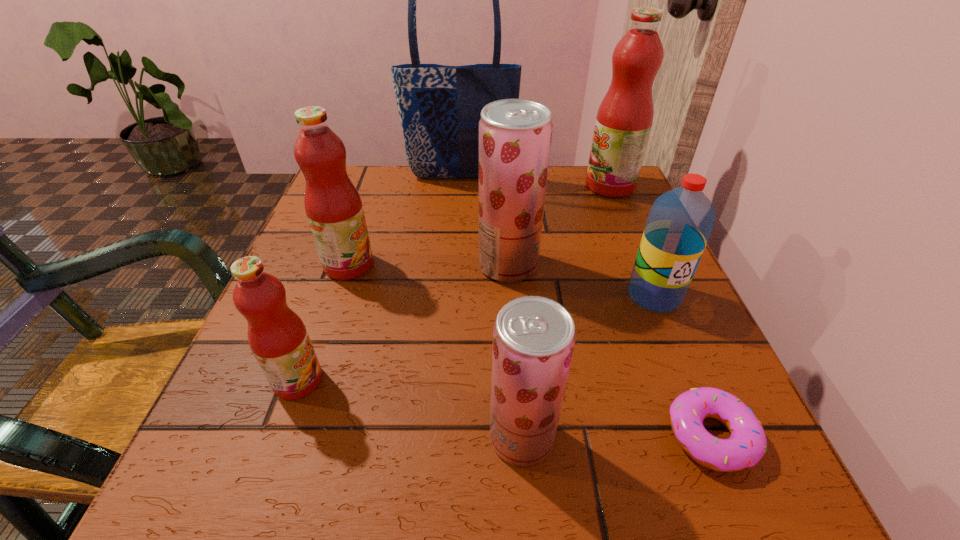
Identify the location of vacant region that satisfies the following two spatial constraints: 1. on the front label of the second nearest pink fruit juice; 2. on the left side of the pink doughnut. (291, 435).

Locate an element on the screen. The width and height of the screenshot is (960, 540). free space that satisfies the following two spatial constraints: 1. on the front-facing side of the nearest fruit juice; 2. on the left side of the shopping bag is located at coordinates (443, 437).

The height and width of the screenshot is (540, 960). Find the location of `vacant region that satisfies the following two spatial constraints: 1. on the front label of the second farthest pink fruit juice; 2. on the back side of the shortest object`. vacant region that satisfies the following two spatial constraints: 1. on the front label of the second farthest pink fruit juice; 2. on the back side of the shortest object is located at coordinates (291, 435).

Locate an element on the screen. The height and width of the screenshot is (540, 960). free spot that satisfies the following two spatial constraints: 1. on the back side of the nearer strawberry fruit juice; 2. on the front label of the second farthest pink fruit juice is located at coordinates (509, 265).